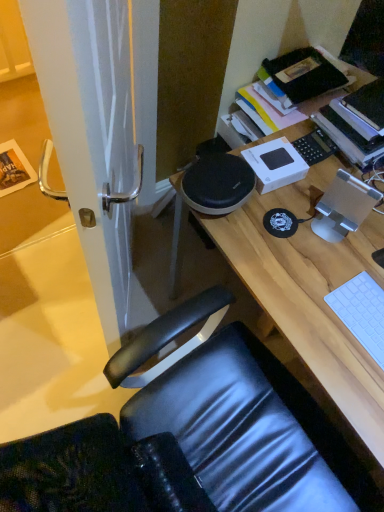
Question: Considering their positions, is hardcover book at upper right located in front of or behind white matte keyboard at lower right?

Choices:
 (A) behind
 (B) front

Answer: (A)

Question: From the image's perspective, is hardcover book at upper right above or below white matte keyboard at lower right?

Choices:
 (A) above
 (B) below

Answer: (A)

Question: Estimate the real-world distances between objects in this image. Which object is farther from the white glossy door handle at left?

Choices:
 (A) hardcover book at upper right
 (B) white matte keyboard at lower right
 (C) wooden desk at center

Answer: (A)

Question: Which object is positioned farthest from the white glossy door handle at left?

Choices:
 (A) hardcover book at upper right
 (B) wooden desk at center
 (C) white matte keyboard at lower right

Answer: (A)